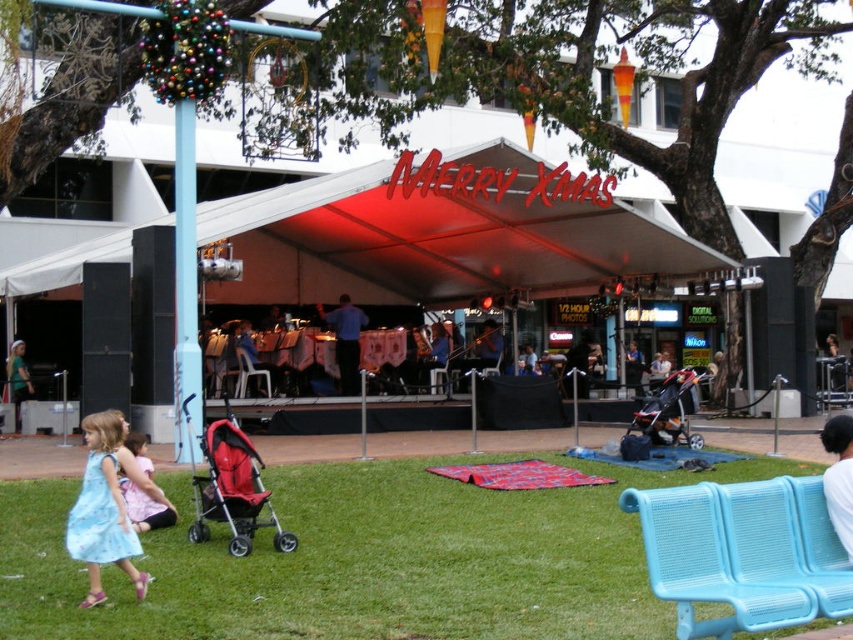
You are standing at the center of the tent and want to find the light blue dress at lower left. According to the coordinates provided, in which direction should you look to locate it?

The light blue dress at lower left is located at coordinates point [142,488], which means it is positioned to the right and slightly below the center of the tent. Therefore, you should look to your right and downward to locate it.

Looking at this image, you are organizing a clothing donation drive and need to decide which of the two shirts, the white fabric shirt at lower right or the blue shirt at stage center, can fit into a narrow donation box that requires the clothing item to be less than 1 inch thick. Based on the description, which shirt should you choose?

The white fabric shirt at lower right is thinner than the blue shirt at stage center, so it can fit into the donation box requiring clothing items to be less than 1 inch thick.

You are organizing a space for a Christmas market and need to place a red fabric stroller at center and a green fabric dress at lower left. Considering their widths, which object requires more horizontal space?

The green fabric dress at lower left requires more horizontal space because it has a greater width than the red fabric stroller at center.